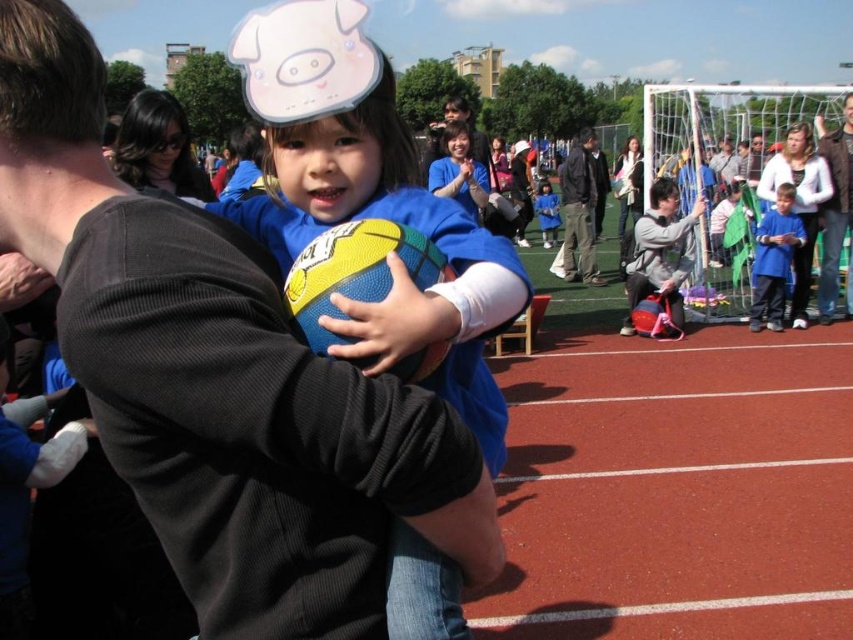
Between gray fabric jacket at right and brown leather jacket at upper right, which one is positioned lower?

gray fabric jacket at right is below.

Is point (662, 284) positioned in front of point (833, 186)?

Yes, point (662, 284) is in front of point (833, 186).

Identify the location of gray fabric jacket at right. (660, 252).

Is blue fabric shirt at right bigger than blue denim jacket at center?

No, blue fabric shirt at right is not bigger than blue denim jacket at center.

Does blue fabric shirt at right appear under blue denim jacket at center?

Correct, blue fabric shirt at right is located below blue denim jacket at center.

This screenshot has height=640, width=853. I want to click on blue fabric shirt at right, so click(775, 259).

What are the coordinates of `brown leather jacket at upper right` in the screenshot? It's located at (836, 214).

Between brown leather jacket at upper right and blue denim jacket at center, which one has less height?

With less height is blue denim jacket at center.

Does point (828, 253) lie behind point (728, 163)?

No, it is not.

Find the location of a particular element. The height and width of the screenshot is (640, 853). brown leather jacket at upper right is located at coordinates (836, 214).